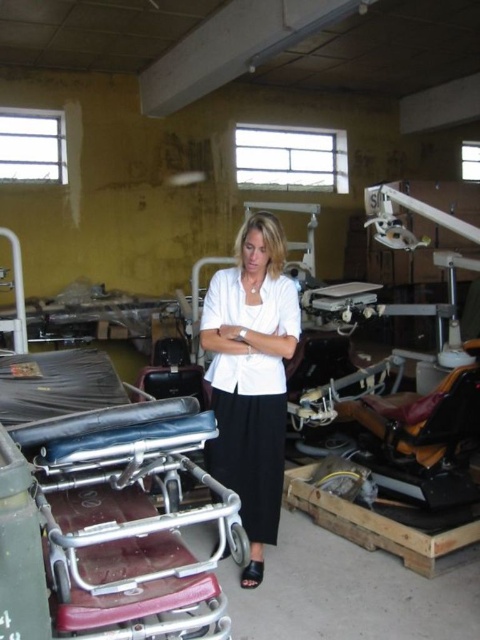
Can you confirm if metallic maroon hospital bed at lower left is thinner than white matte shirt at center?

Incorrect, metallic maroon hospital bed at lower left's width is not less than white matte shirt at center's.

Does metallic maroon hospital bed at lower left appear on the right side of white matte shirt at center?

No, metallic maroon hospital bed at lower left is not to the right of white matte shirt at center.

Where is `metallic maroon hospital bed at lower left`? metallic maroon hospital bed at lower left is located at coordinates (112, 497).

Locate an element on the screen. Image resolution: width=480 pixels, height=640 pixels. metallic maroon hospital bed at lower left is located at coordinates (112, 497).